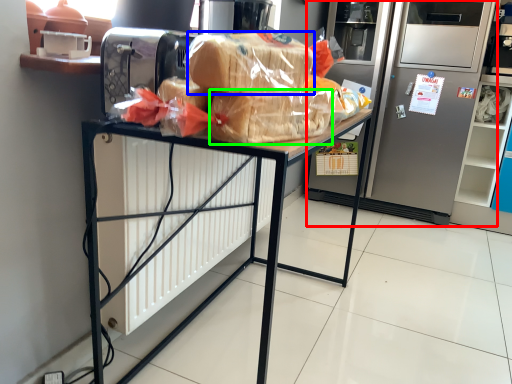
Question: Which object is positioned farthest from refrigerator (highlighted by a red box)? Select from bread (highlighted by a blue box) and snack (highlighted by a green box).

Choices:
 (A) bread
 (B) snack

Answer: (A)